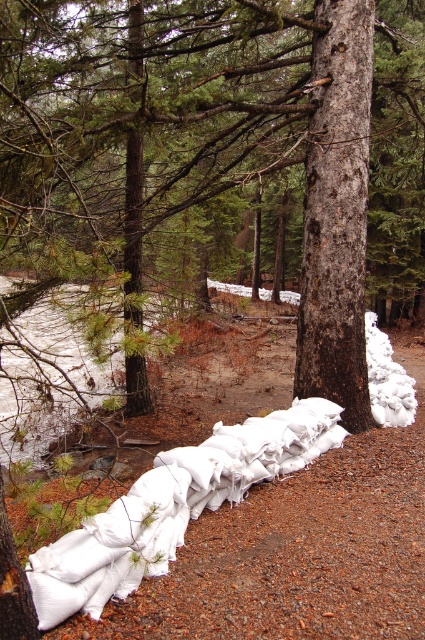
You are standing in the forest near the sandbag barrier. There is a tree marked at point (212, 141). What is the color and texture of the tree at that location?

The tree at point (212, 141) is brown and rough in texture.

You are a hiker trying to navigate through the forest and spot the brown rough tree at center and the smooth brown bark at center. Which one is wider?

The brown rough tree at center is wider than the smooth brown bark at center.